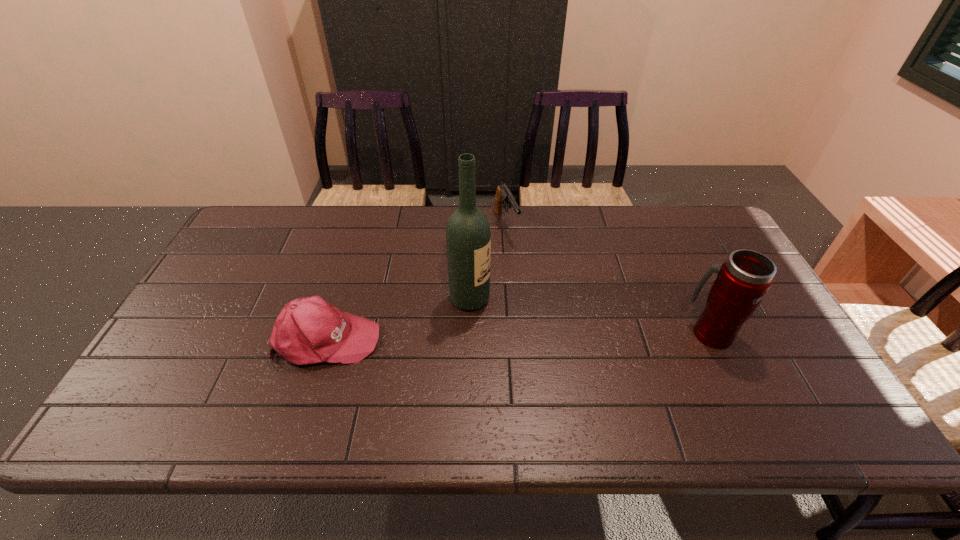
The image size is (960, 540). What are the coordinates of `vacant space at the far edge of the desktop` in the screenshot? It's located at pos(420,238).

What are the coordinates of `free space at the near edge of the desktop` in the screenshot? It's located at (514, 373).

The image size is (960, 540). In order to click on free location at the left edge in this screenshot , I will do `click(235, 300)`.

This screenshot has width=960, height=540. What are the coordinates of `blank area at the right edge` in the screenshot? It's located at (794, 354).

Image resolution: width=960 pixels, height=540 pixels. Identify the location of free space at the far right corner of the desktop. (681, 230).

Find the location of `free space between the baseball cap and the gun`. free space between the baseball cap and the gun is located at coordinates 416,281.

At what (x,y) coordinates should I click in order to perform the action: click on vacant point located between the third shortest object and the third object from left to right. Please return your answer as a coordinate pair (x, y). The height and width of the screenshot is (540, 960). Looking at the image, I should click on (608, 279).

The image size is (960, 540). What are the coordinates of `free space between the second object from left to right and the leftmost object` in the screenshot? It's located at (398, 319).

The image size is (960, 540). What are the coordinates of `unoccupied area between the farthest object and the second tallest object` in the screenshot? It's located at (608, 279).

The height and width of the screenshot is (540, 960). In order to click on empty space between the tallest object and the baseball cap in this screenshot , I will do `click(398, 319)`.